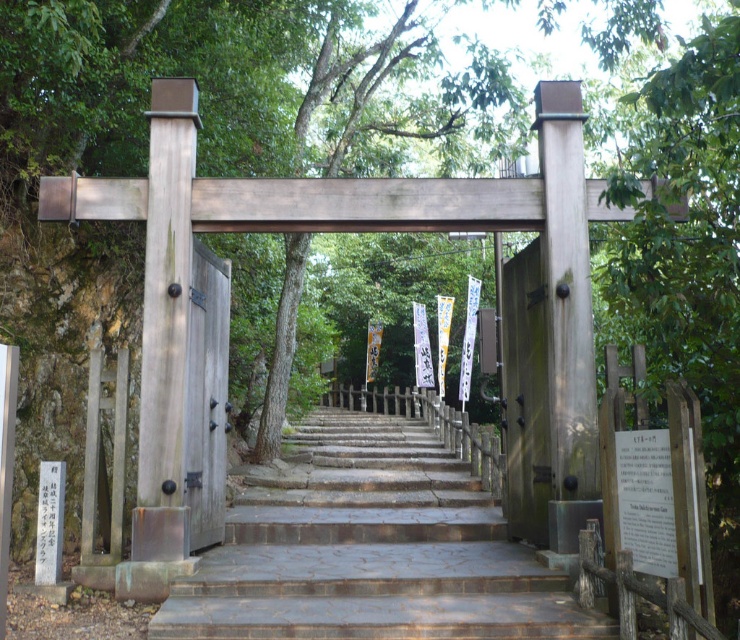
You are a visitor approaching the shrine and need to pass through the wooden gate at right and the wooden door at center. Which structure is taller?

The wooden gate at right is taller than the wooden door at center.

You are a visitor approaching the sacred space. You see the wooden gate at right and the wooden door at center. Which one is wider?

The wooden gate at right might be wider than wooden door at center.